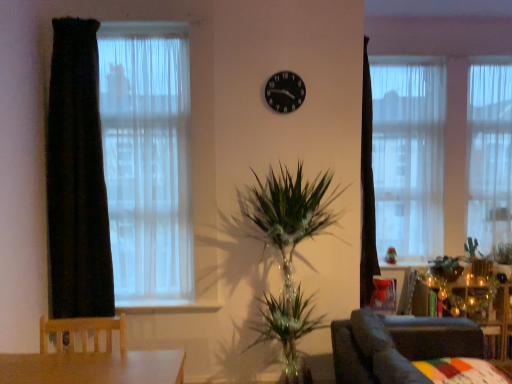
Where is `free point above white sheer curtain at right, which appears as the third curtain when viewed from the left (from a real-world perspective)`? The height and width of the screenshot is (384, 512). free point above white sheer curtain at right, which appears as the third curtain when viewed from the left (from a real-world perspective) is located at coordinates (489, 54).